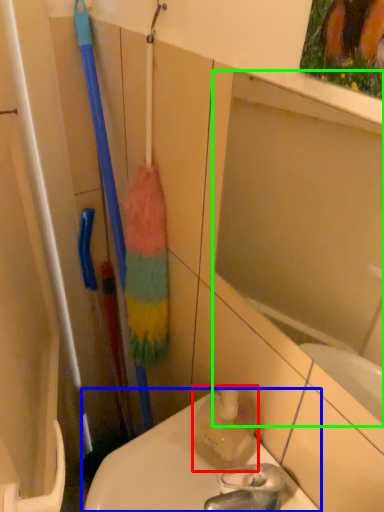
Question: Which object is positioned farthest from cleaning product (highlighted by a red box)? Select from toilet (highlighted by a blue box) and mirror (highlighted by a green box).

Choices:
 (A) toilet
 (B) mirror

Answer: (B)